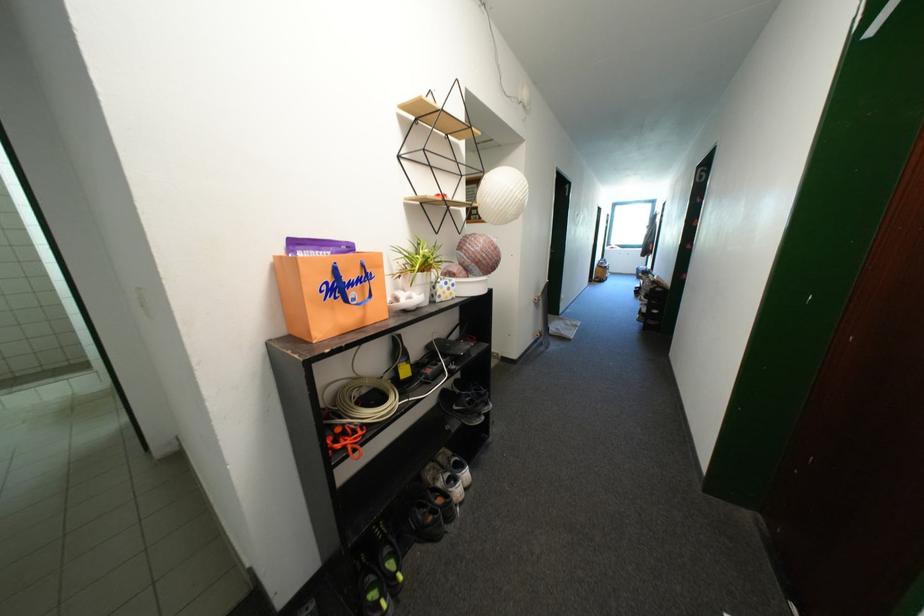
At what (x,y) coordinates should I click in order to perform the action: click on orange clamp handle. Please return your answer as a coordinate pair (x, y). Image resolution: width=924 pixels, height=616 pixels. Looking at the image, I should click on (345, 439).